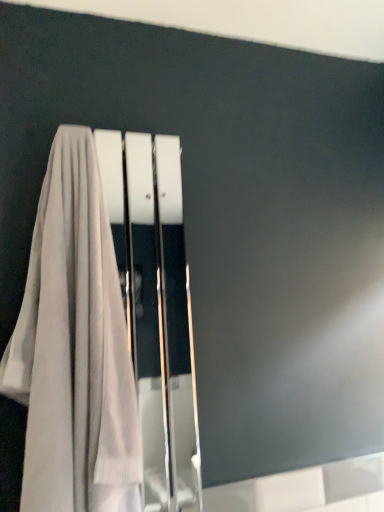
Describe the element at coordinates (74, 348) in the screenshot. I see `light beige fabric towel at left` at that location.

Identify the location of light beige fabric towel at left. This screenshot has height=512, width=384. (74, 348).

This screenshot has height=512, width=384. What do you see at coordinates (156, 309) in the screenshot? I see `white glossy screen door at center` at bounding box center [156, 309].

Find the location of a particular element. The width and height of the screenshot is (384, 512). white glossy screen door at center is located at coordinates (156, 309).

Locate an element on the screen. The width and height of the screenshot is (384, 512). light beige fabric towel at left is located at coordinates (74, 348).

Looking at this image, considering the positions of objects white glossy screen door at center and light beige fabric towel at left in the image provided, who is more to the left, white glossy screen door at center or light beige fabric towel at left?

light beige fabric towel at left is more to the left.

Considering the positions of objects white glossy screen door at center and light beige fabric towel at left in the image provided, who is behind, white glossy screen door at center or light beige fabric towel at left?

white glossy screen door at center is further from the camera.

Is point (133, 189) in front of point (86, 468)?

That is False.

From the image's perspective, which one is positioned lower, white glossy screen door at center or light beige fabric towel at left?

white glossy screen door at center.

Consider the image. From a real-world perspective, which object stands above the other?

light beige fabric towel at left is physically above.

Which of these two, white glossy screen door at center or light beige fabric towel at left, is thinner?

white glossy screen door at center is thinner.

Can you confirm if white glossy screen door at center is shorter than light beige fabric towel at left?

In fact, white glossy screen door at center may be taller than light beige fabric towel at left.

Considering the relative sizes of white glossy screen door at center and light beige fabric towel at left in the image provided, is white glossy screen door at center bigger than light beige fabric towel at left?

Incorrect, white glossy screen door at center is not larger than light beige fabric towel at left.

Is white glossy screen door at center not inside light beige fabric towel at left?

No, white glossy screen door at center is not entirely external to light beige fabric towel at left.

Is white glossy screen door at center not near light beige fabric towel at left?

white glossy screen door at center is actually quite close to light beige fabric towel at left.

Is white glossy screen door at center oriented towards light beige fabric towel at left?

Yes, white glossy screen door at center is aimed at light beige fabric towel at left.

Looking at this image, how different are the orientations of white glossy screen door at center and light beige fabric towel at left in degrees?

The facing directions of white glossy screen door at center and light beige fabric towel at left are 1.58 degrees apart.

This screenshot has width=384, height=512. I want to click on screen door that appears below the light beige fabric towel at left (from the image's perspective), so click(156, 309).

Consider the image. Can you confirm if light beige fabric towel at left is positioned to the left of white glossy screen door at center?

Yes.

Is the depth of light beige fabric towel at left less than that of white glossy screen door at center?

Yes, it is in front of white glossy screen door at center.

Is point (113, 351) more distant than point (151, 387)?

No, (113, 351) is in front of (151, 387).

From the image's perspective, does light beige fabric towel at left appear lower than white glossy screen door at center?

No.

From a real-world perspective, is light beige fabric towel at left positioned under white glossy screen door at center based on gravity?

No.

In terms of width, does light beige fabric towel at left look wider or thinner when compared to white glossy screen door at center?

Clearly, light beige fabric towel at left has more width compared to white glossy screen door at center.

In terms of height, does light beige fabric towel at left look taller or shorter compared to white glossy screen door at center?

Considering their sizes, light beige fabric towel at left has less height than white glossy screen door at center.

Which of these two, light beige fabric towel at left or white glossy screen door at center, is bigger?

light beige fabric towel at left.

Is light beige fabric towel at left located outside white glossy screen door at center?

That's correct, light beige fabric towel at left is outside of white glossy screen door at center.

Is light beige fabric towel at left next to white glossy screen door at center and touching it?

No, light beige fabric towel at left is not beside white glossy screen door at center.

Is light beige fabric towel at left facing towards white glossy screen door at center?

No, light beige fabric towel at left does not turn towards white glossy screen door at center.

What's the angular difference between light beige fabric towel at left and white glossy screen door at center's facing directions?

1.58 degrees.

The height and width of the screenshot is (512, 384). Find the location of `screen door that is below the light beige fabric towel at left (from the image's perspective)`. screen door that is below the light beige fabric towel at left (from the image's perspective) is located at coordinates (156, 309).

At what (x,y) coordinates should I click in order to perform the action: click on towel that appears above the white glossy screen door at center (from a real-world perspective). Please return your answer as a coordinate pair (x, y). Looking at the image, I should click on (74, 348).

You are a GUI agent. You are given a task and a screenshot of the screen. Output one action in this format:
    pyautogui.click(x=<x>, y=<y>)
    Task: Click on the towel above the white glossy screen door at center (from the image's perspective)
    
    Given the screenshot: What is the action you would take?
    pyautogui.click(x=74, y=348)